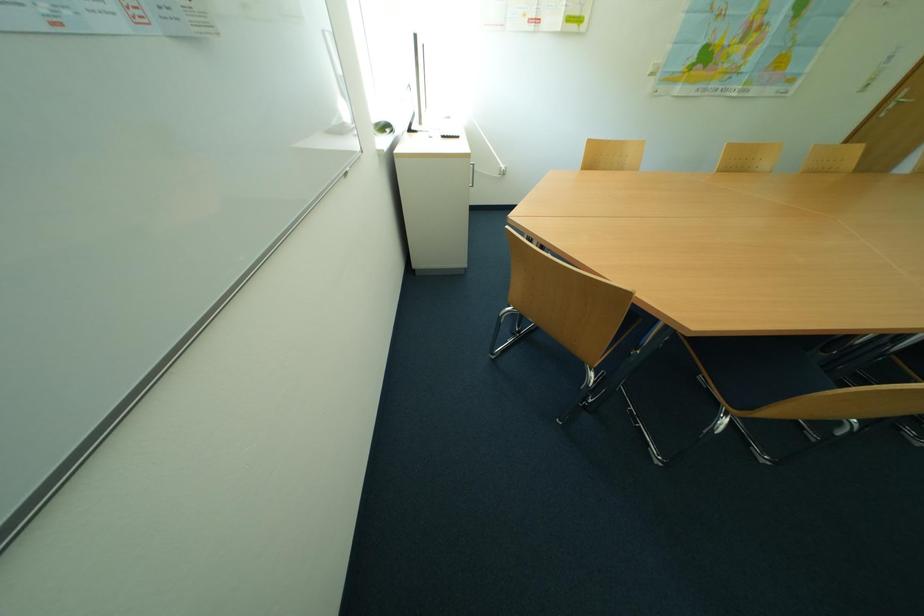
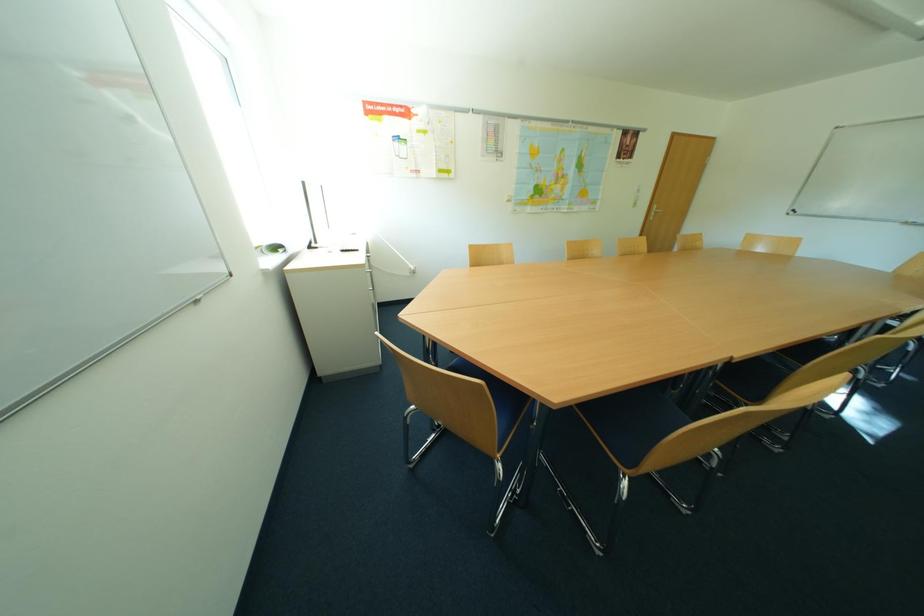
Question: In a continuous first-person perspective shot, in which direction is the camera moving?

Choices:
 (A) Left
 (B) Right
 (C) Forward
 (D) Backward

Answer: (B)